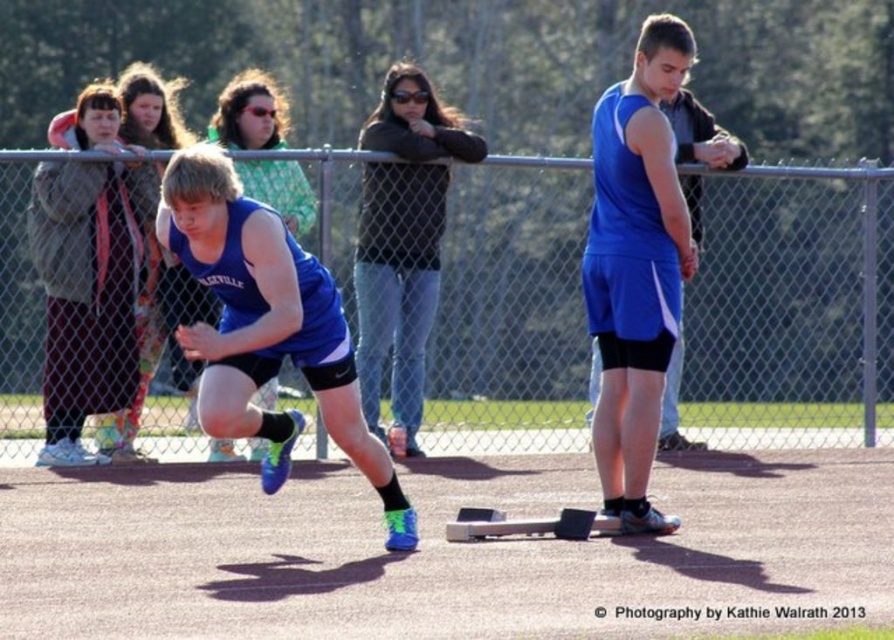
Question: Which point is farther from the camera taking this photo?

Choices:
 (A) (316, 248)
 (B) (294, 420)
 (C) (111, 90)
 (D) (597, 100)

Answer: (D)

Question: Which is farther from the dark gray fleece jacket at left?

Choices:
 (A) metal chain-link fence at upper center
 (B) blue matte shorts at center
 (C) dark brown sweater at center
 (D) blue matte tank top at center

Answer: (B)

Question: Is metal chain-link fence at upper center above dark brown sweater at center?

Choices:
 (A) yes
 (B) no

Answer: (B)

Question: Which of the following is the farthest from the observer?

Choices:
 (A) blue matte shorts at center
 (B) dark gray fleece jacket at left
 (C) dark brown sweater at center

Answer: (C)

Question: Considering the relative positions of dark gray fleece jacket at left and dark brown sweater at center in the image provided, where is dark gray fleece jacket at left located with respect to dark brown sweater at center?

Choices:
 (A) right
 (B) left

Answer: (B)

Question: Can you confirm if blue matte tank top at center is thinner than dark gray fleece jacket at left?

Choices:
 (A) yes
 (B) no

Answer: (B)